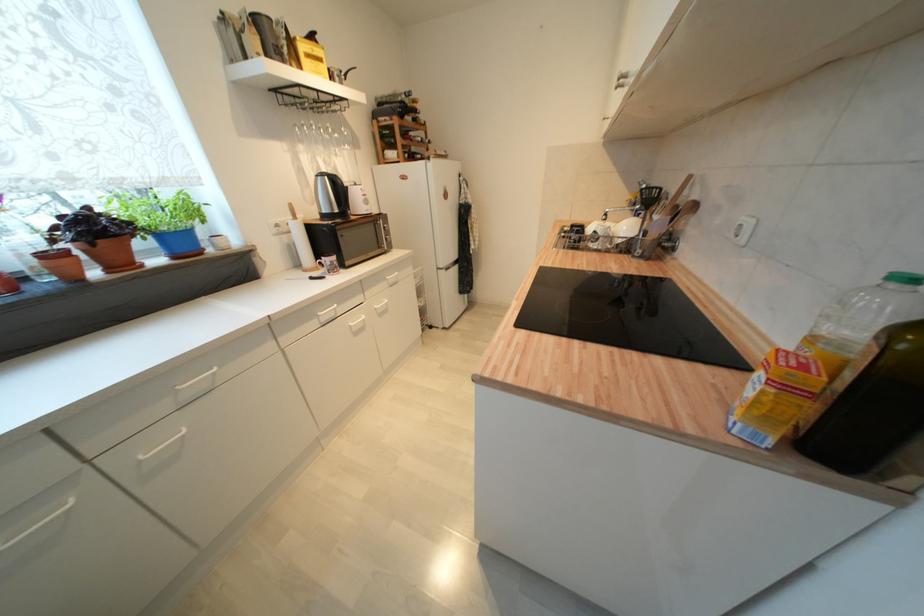
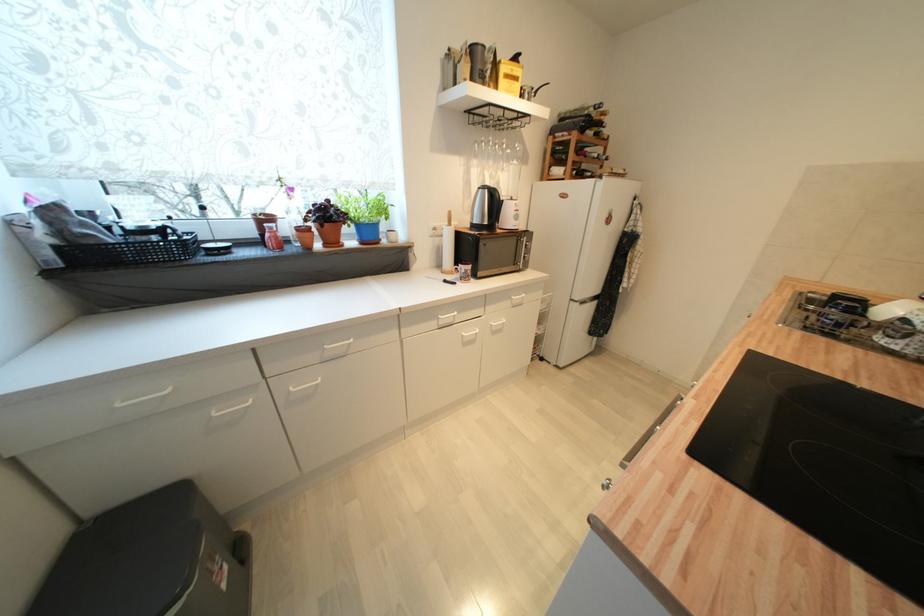
Question: The first image is from the beginning of the video and the second image is from the end. How did the camera likely rotate when shooting the video?

Choices:
 (A) Left
 (B) Right
 (C) Up
 (D) Down

Answer: (A)